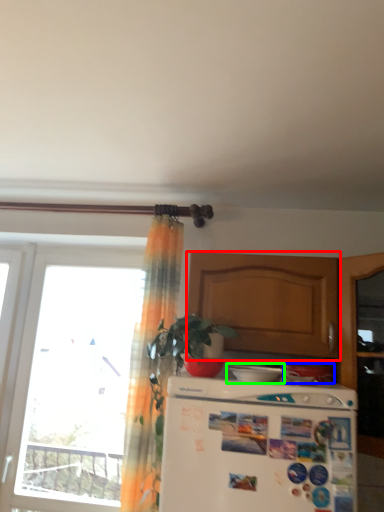
Question: Which object is positioned closest to cabinetry (highlighted by a red box)? Select from appliance (highlighted by a blue box) and appliance (highlighted by a green box).

Choices:
 (A) appliance
 (B) appliance

Answer: (B)